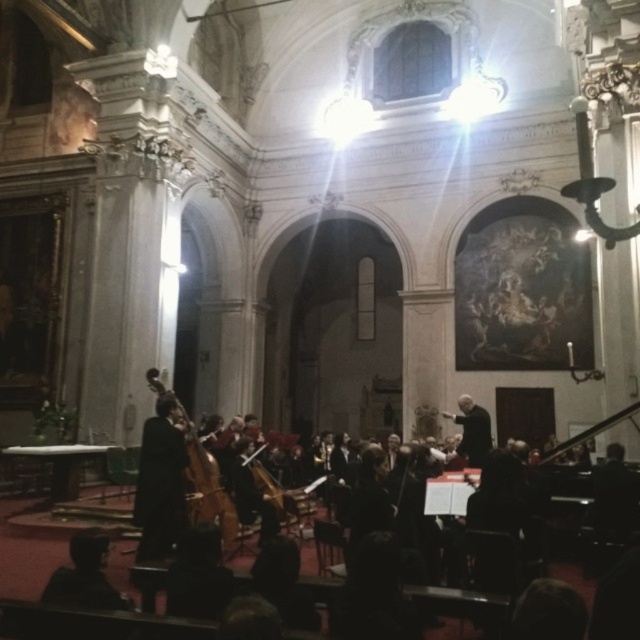
You are a photographer positioned at the back of the cathedral. You want to take a photo of both the black velvet suit at center and the black matte conductor at center. Which one will appear larger in your photo?

The black velvet suit at center will appear larger in the photo because it is closer to the viewer than the black matte conductor at center.

You are standing in the center of the church and want to place a new statue exactly where the wooden polished cello at center is currently located. What coordinates should you use for placement?

The wooden polished cello at center is located at coordinates point (198, 472), so you should place the statue at those coordinates.

You are a stagehand preparing to adjust the lighting for the performance. You notice the black velvet suit at center and the black matte conductor at center. Which object requires a higher spotlight adjustment to fully illuminate?

The black velvet suit at center requires a higher spotlight adjustment because it is much taller than the black matte conductor at center, so the light needs to reach higher to fully illuminate it.